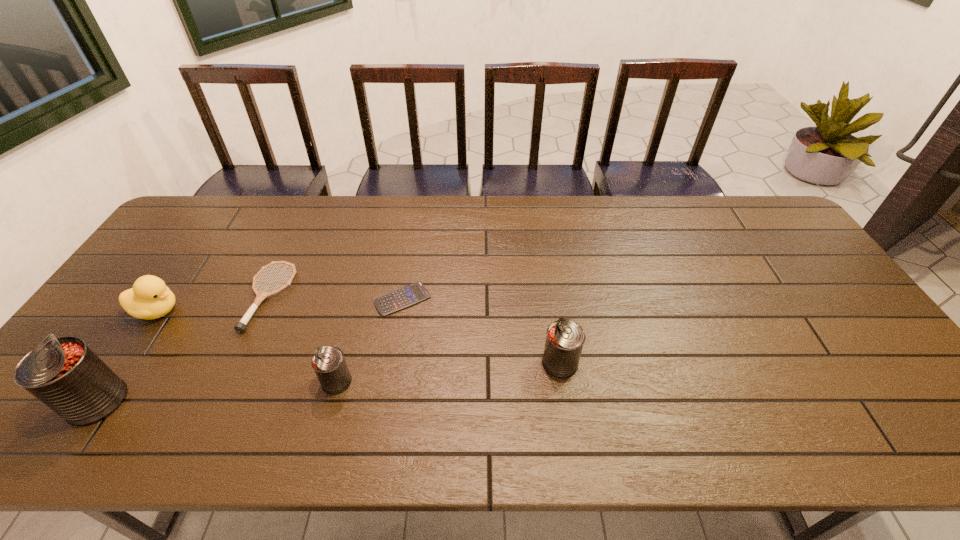
Where is `duck`? This screenshot has height=540, width=960. duck is located at coordinates (150, 298).

The image size is (960, 540). Find the location of `free space located on the right of the tallest object`. free space located on the right of the tallest object is located at coordinates (275, 401).

At what (x,y) coordinates should I click in order to perform the action: click on vacant space located 0.070m on the back of the shortest can. Please return your answer as a coordinate pair (x, y). Looking at the image, I should click on (x=346, y=346).

Where is `vacant region located 0.170m on the right of the fifth shortest object`? vacant region located 0.170m on the right of the fifth shortest object is located at coordinates pyautogui.click(x=646, y=363).

Find the location of a particular element. Image resolution: width=960 pixels, height=540 pixels. free space located 0.050m on the right of the third object from left to right is located at coordinates (307, 297).

The height and width of the screenshot is (540, 960). Find the location of `vacant region located on the front of the shortest object`. vacant region located on the front of the shortest object is located at coordinates 385,407.

At what (x,y) coordinates should I click in order to perform the action: click on free space located 0.050m on the front-facing side of the duck. Please return your answer as a coordinate pair (x, y). This screenshot has height=540, width=960. Looking at the image, I should click on (201, 311).

The image size is (960, 540). I want to click on can that is at the left edge, so click(x=64, y=373).

Find the location of a particular element. This screenshot has height=540, width=960. duck that is positioned at the left edge is located at coordinates (150, 298).

This screenshot has width=960, height=540. Identify the location of object that is positioned at the near left corner. point(64,373).